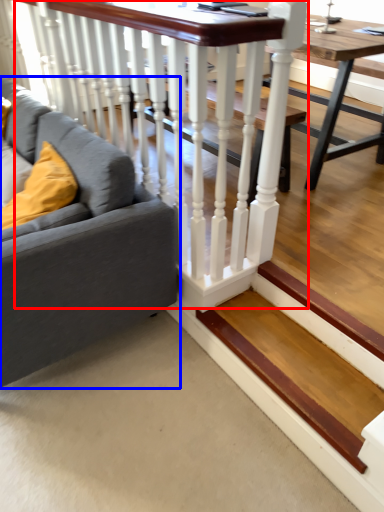
Question: Among these objects, which one is nearest to the camera, rail (highlighted by a red box) or studio couch (highlighted by a blue box)?

Choices:
 (A) rail
 (B) studio couch

Answer: (B)